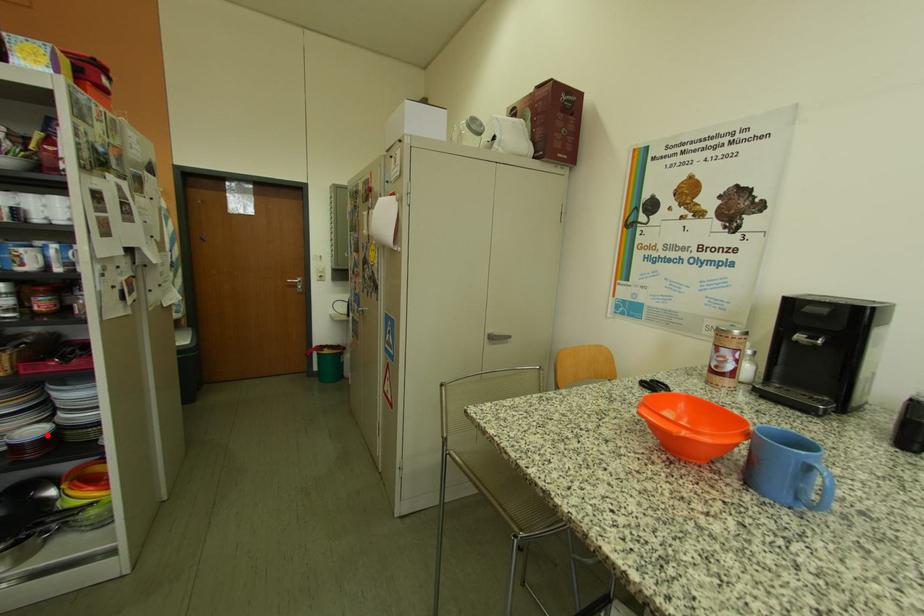
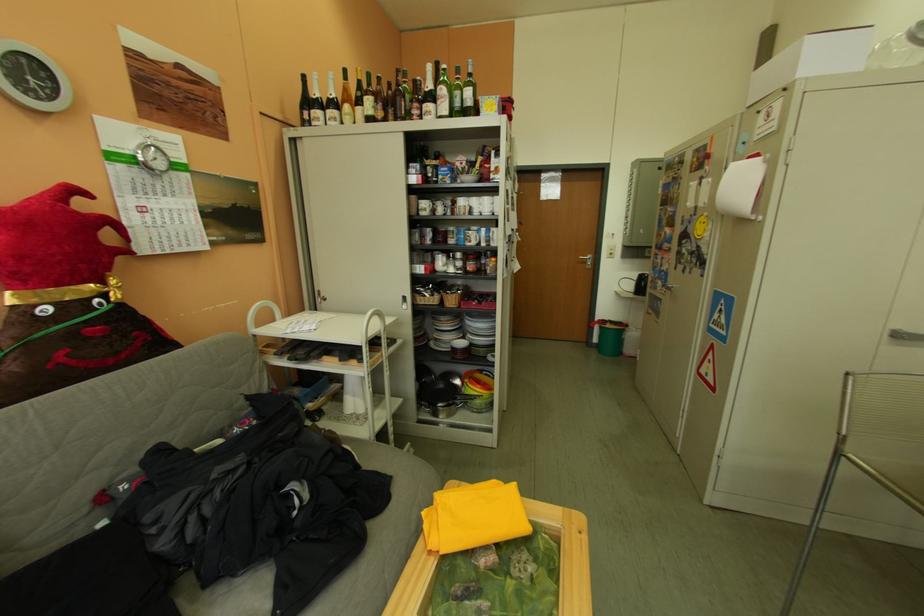
The point at the highlighted location is marked in the first image. Where is the corresponding point in the second image?

(473, 346)